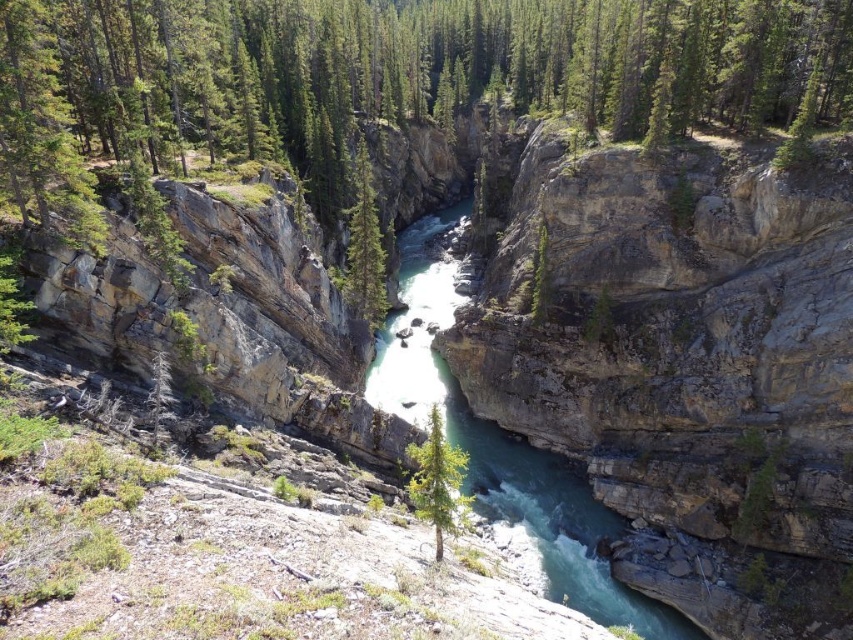
Question: Can you confirm if turquoise smooth river at center is wider than green textured tree at center?

Choices:
 (A) yes
 (B) no

Answer: (A)

Question: Considering the real-world distances, which object is closest to the turquoise smooth river at center?

Choices:
 (A) green textured tree at center
 (B) green matte tree at center

Answer: (A)

Question: Is turquoise smooth river at center positioned before green textured tree at center?

Choices:
 (A) no
 (B) yes

Answer: (B)

Question: Which point appears closest to the camera in this image?

Choices:
 (A) (440, 298)
 (B) (357, 296)

Answer: (B)

Question: Which point is farther to the camera?

Choices:
 (A) turquoise smooth river at center
 (B) green textured tree at center

Answer: (B)

Question: Does green matte tree at center appear under green textured tree at center?

Choices:
 (A) no
 (B) yes

Answer: (B)